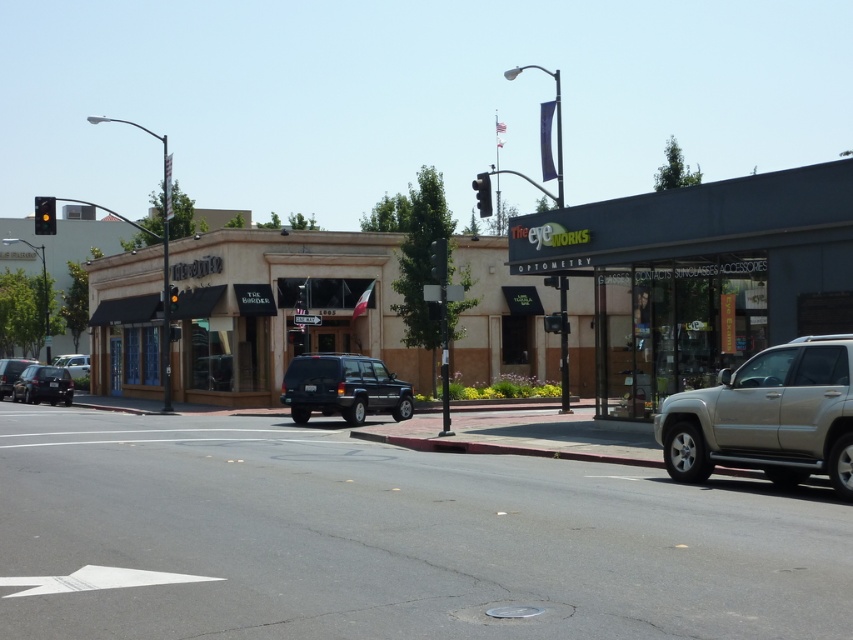
You are a delivery driver needing to park your 5.5 meter long truck between the matte black car at lower left and the metallic silver car at left. Can you fit your truck there?

The distance between the matte black car at lower left and the metallic silver car at left is 12.91 meters, which is more than enough to accommodate a 5.5 meter long truck.

You are standing at the point labeled point (270, 538) and want to walk to point (737, 257). Which direction should you move to get closer to your destination?

You should move away from the camera because point (737, 257) is further from the camera than point (270, 538).